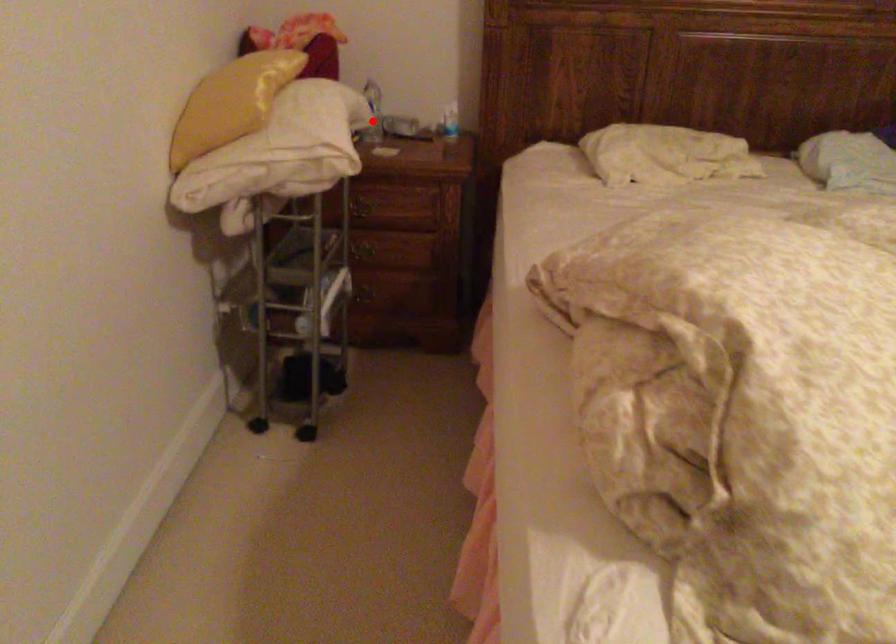
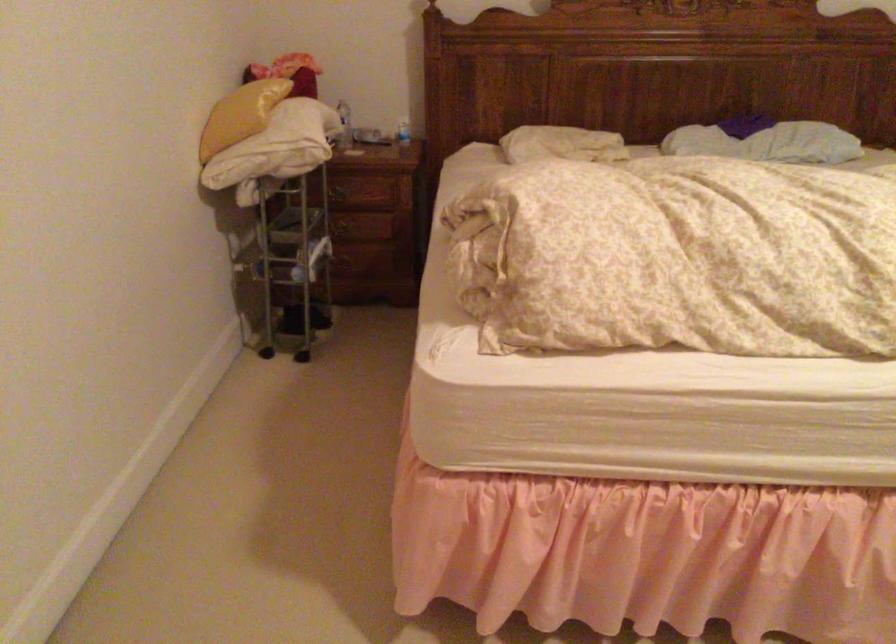
Question: I am providing you with two images of the same scene from different viewpoints. A red point is shown in image1. For the corresponding object point in image2, is it positioned nearer or farther from the camera?

Choices:
 (A) Nearer
 (B) Farther

Answer: (B)